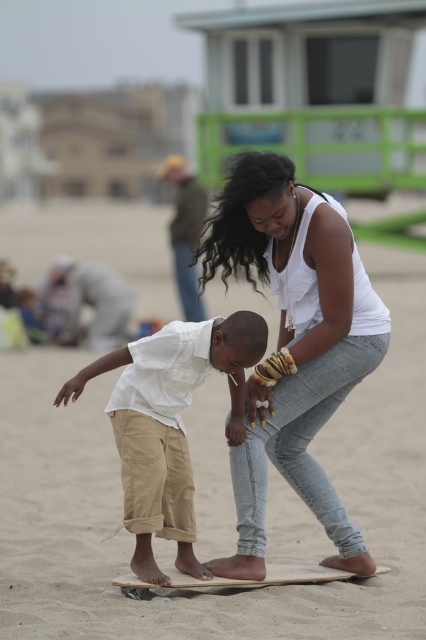
Is white cotton shirt at center closer to the viewer compared to wooden skateboard at center?

That is True.

Locate an element on the screen. The image size is (426, 640). white cotton shirt at center is located at coordinates pos(172,419).

What are the coordinates of `white cotton shirt at center` in the screenshot? It's located at (172, 419).

Is beige sand at center shorter than white cotton shirt at center?

No.

Which is behind, point (16, 534) or point (189, 346)?

The point (16, 534) is more distant.

The image size is (426, 640). I want to click on beige sand at center, so click(132, 538).

Does point (284, 230) come behind point (296, 577)?

Yes, point (284, 230) is behind point (296, 577).

Is point (284, 426) more distant than point (203, 582)?

Yes, point (284, 426) is behind point (203, 582).

Find the location of a particular element. The width and height of the screenshot is (426, 640). white matte tank top at center is located at coordinates (293, 346).